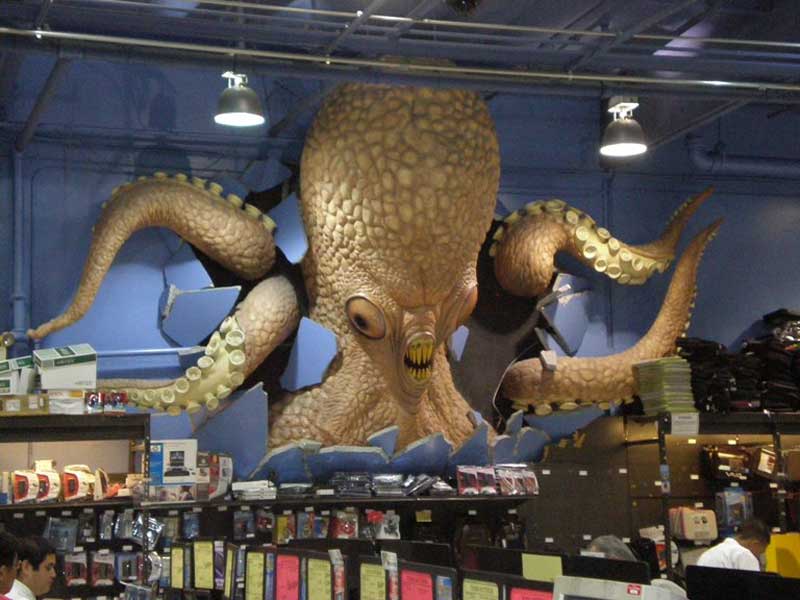
At what (x,y) coordinates should I click in order to perform the action: click on ceiling. Please return your answer as a coordinate pair (x, y). Looking at the image, I should click on (538, 109).